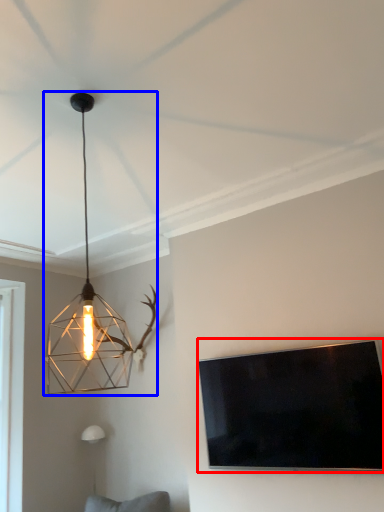
Question: Which of the following is the closest to the observer, television (highlighted by a red box) or lamp (highlighted by a blue box)?

Choices:
 (A) television
 (B) lamp

Answer: (B)